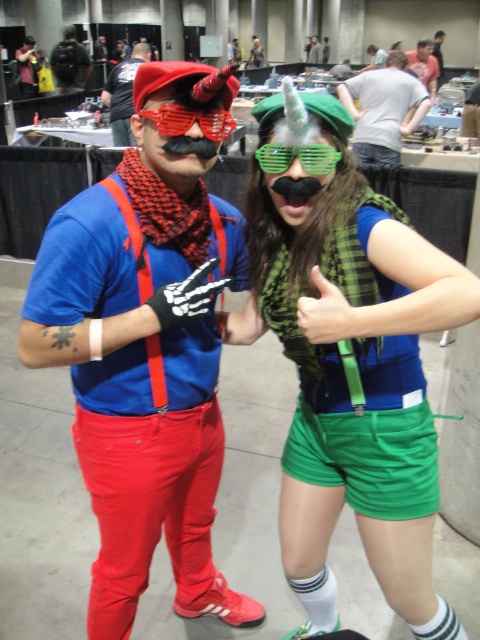
You are an event organizer trying to arrange a photo shoot. You notice the matte red pants at left and the matte red suspenders at center. Which of these two items is larger in size?

The matte red suspenders at center are larger than the matte red pants at left.

You are standing in the convention hall and notice the matte red pants at left. If you want to locate them precisely on a coordinate grid where the bottom left corner is the origin, what are their coordinates?

The matte red pants at left are located at coordinates point (145, 352).